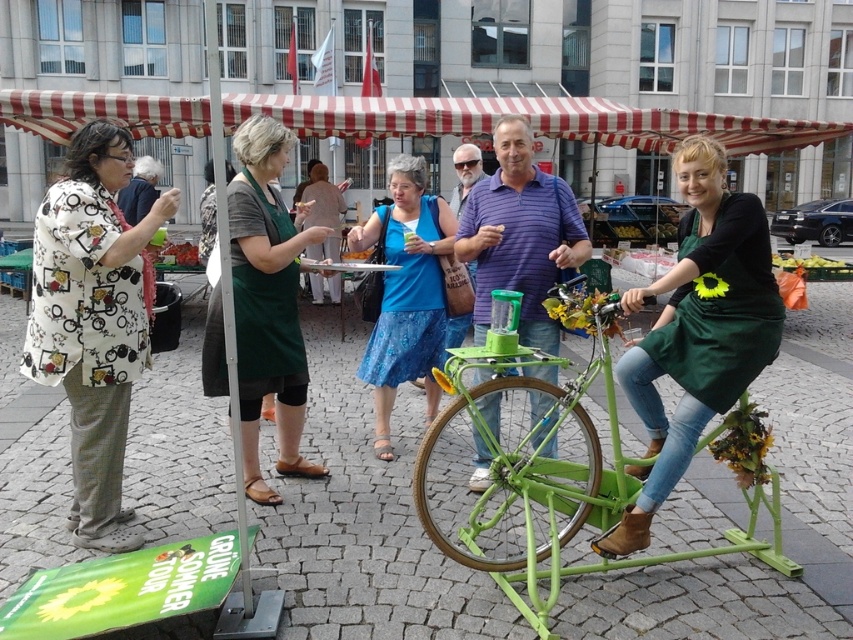
You are a photographer at the outdoor market scene. You want to capture a photo where the white printed blouse at left and the green matte bicycle at center are both clearly visible. Based on their positions, which object should you focus on first to ensure both are in frame?

The white printed blouse at left is below the green matte bicycle at center. To ensure both are in frame, focus on the green matte bicycle at center first, as it is higher up, allowing the blouse to naturally fall into the lower part of the composition.

From the picture: You are standing in the outdoor market scene and want to know which of the two points, point (392, 221) or point (177, 259), is closer to you. Can you determine this based on their positions?

Point (392, 221) is closer to the viewer than point (177, 259).